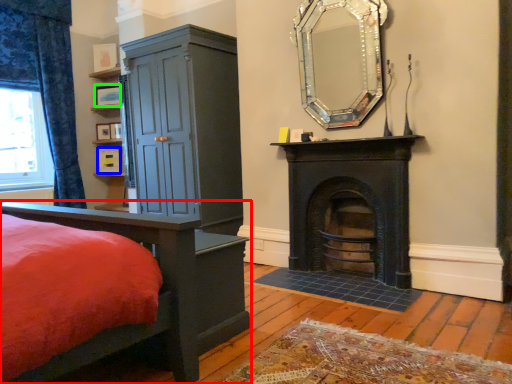
Question: Which object is the farthest from bed (highlighted by a red box)? Choose among these: picture frame (highlighted by a blue box) or picture frame (highlighted by a green box).

Choices:
 (A) picture frame
 (B) picture frame

Answer: (B)